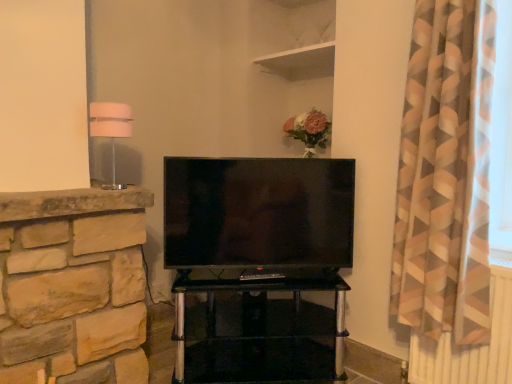
Where is `free spot above white matte shelf at upper center, which ranks as the first shelf in bottom-to-top order (from a real-world perspective)`? This screenshot has width=512, height=384. free spot above white matte shelf at upper center, which ranks as the first shelf in bottom-to-top order (from a real-world perspective) is located at coordinates (297, 56).